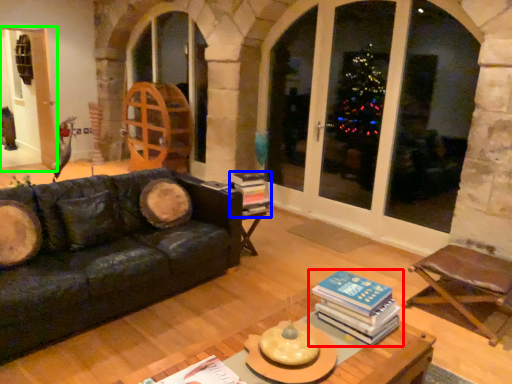
Question: Estimate the real-world distances between objects in this image. Which object is farther from book (highlighted by a red box), book (highlighted by a blue box) or screen door (highlighted by a green box)?

Choices:
 (A) book
 (B) screen door

Answer: (B)